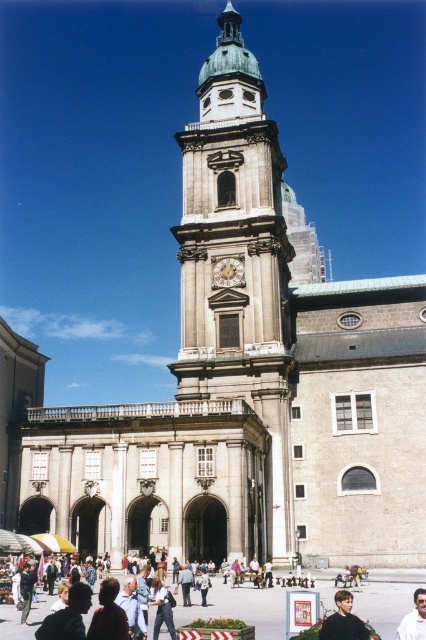
Looking at this image, you are standing in front of the grand architectural structure and want to know if the gold ornate clock at center can fit through a doorway that is the same width as the light blue denim jeans at center. Can it?

The gold ornate clock at center might be wider than light blue denim jeans at center, so it may not fit through the doorway.

You are standing in front of the grand architectural structure described, and you notice two people wearing a white shirt at center and light blue jeans at center. From your perspective, which clothing item is closer to you?

The white shirt at center is closer to you because it is in front of the light blue jeans at center.